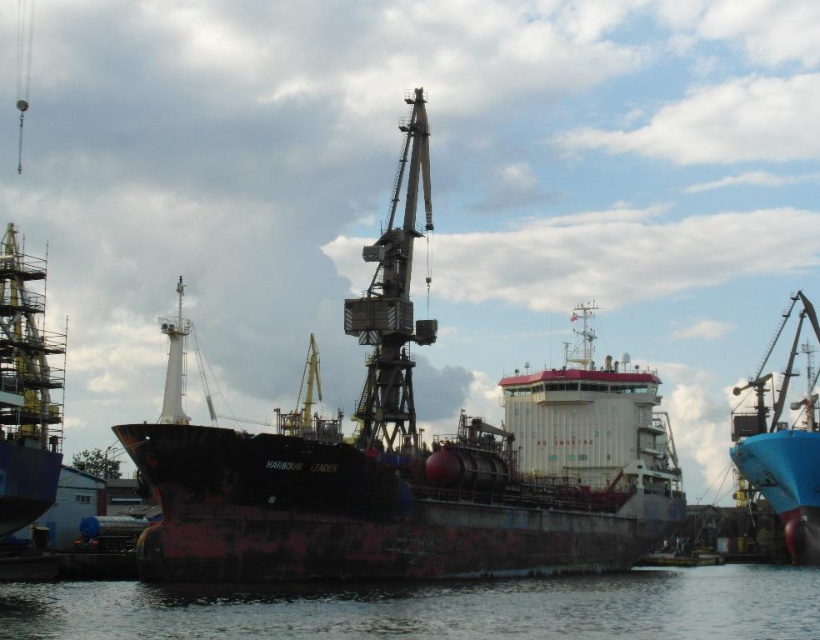
Can you confirm if rusty metal crane at center is bigger than rusty metal ship at left?

Yes, rusty metal crane at center is bigger than rusty metal ship at left.

What are the coordinates of `rusty metal crane at center` in the screenshot? It's located at (393, 301).

Find the location of `rusty metal crane at center`. rusty metal crane at center is located at coordinates (393, 301).

Does rusty metal ship at center have a larger size compared to blue matte boat at right?

Yes.

The image size is (820, 640). Find the location of `rusty metal ship at center`. rusty metal ship at center is located at coordinates (417, 461).

Is rusty metal ship at center above rusty metal ship at left?

Yes.

Does rusty metal ship at center have a smaller size compared to rusty metal ship at left?

Actually, rusty metal ship at center might be larger than rusty metal ship at left.

You are a GUI agent. You are given a task and a screenshot of the screen. Output one action in this format:
    pyautogui.click(x=<x>, y=<y>)
    Task: Click on the rusty metal ship at center
    The height and width of the screenshot is (640, 820).
    Given the screenshot: What is the action you would take?
    pyautogui.click(x=417, y=461)

Where is `rusty metal ship at center`? rusty metal ship at center is located at coordinates (417, 461).